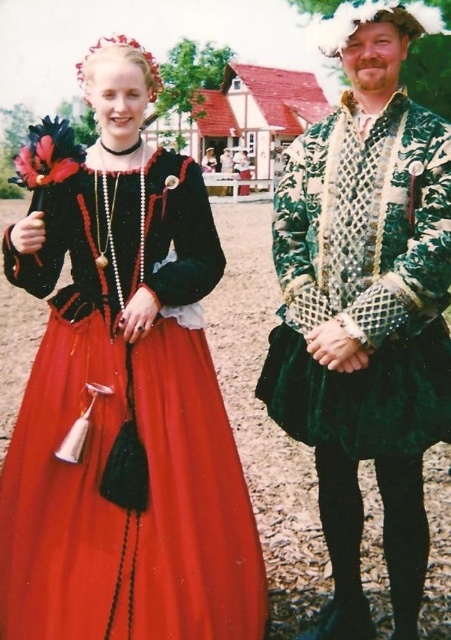
Where is `matte black dress at center`? The width and height of the screenshot is (451, 640). matte black dress at center is located at coordinates (122, 392).

Does matte black dress at center have a greater width compared to velvet green coat at center?

Yes, matte black dress at center is wider than velvet green coat at center.

The width and height of the screenshot is (451, 640). I want to click on matte black dress at center, so click(122, 392).